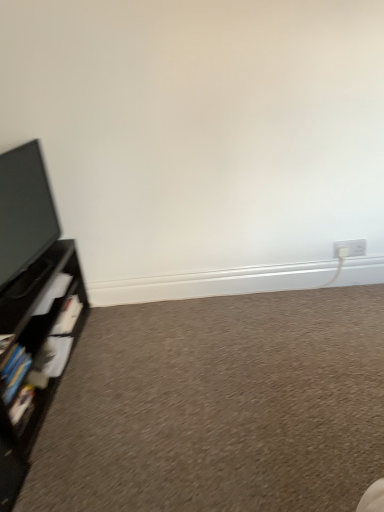
Question: Is carpet at lower left beside white plastic electric outlet at lower right?

Choices:
 (A) no
 (B) yes

Answer: (A)

Question: From the image's perspective, does carpet at lower left appear higher than white plastic electric outlet at lower right?

Choices:
 (A) no
 (B) yes

Answer: (A)

Question: Does carpet at lower left appear on the right side of white plastic electric outlet at lower right?

Choices:
 (A) no
 (B) yes

Answer: (A)

Question: Considering the relative sizes of carpet at lower left and white plastic electric outlet at lower right in the image provided, is carpet at lower left smaller than white plastic electric outlet at lower right?

Choices:
 (A) no
 (B) yes

Answer: (A)

Question: Is carpet at lower left turned away from white plastic electric outlet at lower right?

Choices:
 (A) no
 (B) yes

Answer: (A)

Question: From the image's perspective, is carpet at lower left below white plastic electric outlet at lower right?

Choices:
 (A) no
 (B) yes

Answer: (B)

Question: Is carpet at lower left positioned before black matte shelf at left?

Choices:
 (A) yes
 (B) no

Answer: (A)

Question: From a real-world perspective, does carpet at lower left stand above black matte shelf at left?

Choices:
 (A) no
 (B) yes

Answer: (A)

Question: Can you confirm if carpet at lower left is taller than black matte shelf at left?

Choices:
 (A) no
 (B) yes

Answer: (A)

Question: Is carpet at lower left in contact with black matte shelf at left?

Choices:
 (A) yes
 (B) no

Answer: (B)

Question: From a real-world perspective, does carpet at lower left sit lower than black matte shelf at left?

Choices:
 (A) no
 (B) yes

Answer: (B)

Question: Is carpet at lower left outside of black matte shelf at left?

Choices:
 (A) no
 (B) yes

Answer: (B)

Question: Does white plastic electric outlet at lower right have a larger size compared to black matte shelf at left?

Choices:
 (A) yes
 (B) no

Answer: (B)